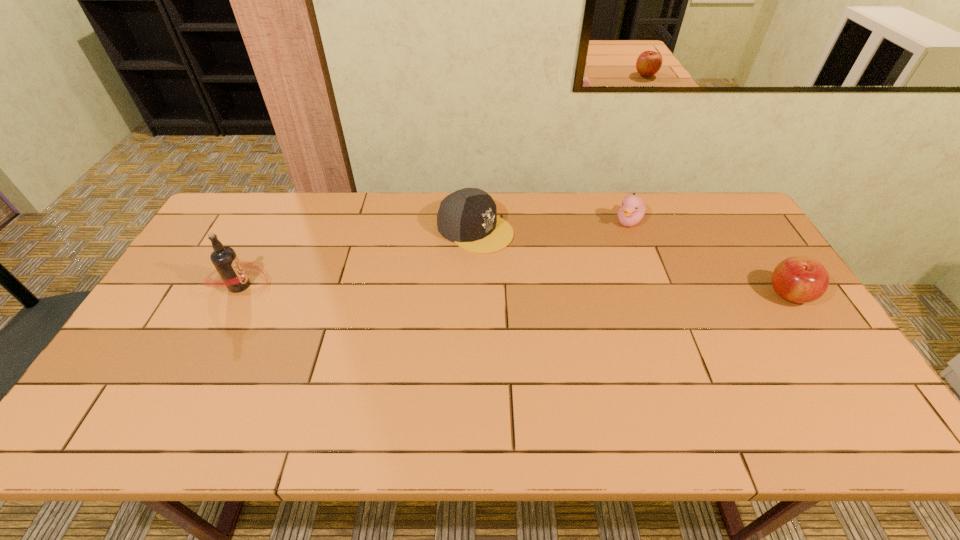
Identify the location of vacant space at the near edge of the desktop. (220, 390).

In the image, there is a desktop. Identify the location of vacant space at the left edge. (192, 281).

Where is `vacant space at the right edge of the desktop`? The image size is (960, 540). vacant space at the right edge of the desktop is located at coordinates (786, 306).

What are the coordinates of `vacant space at the far left corner of the desktop` in the screenshot? It's located at (268, 195).

Identify the location of vacant area at the near left corner of the desktop. The image size is (960, 540). (121, 377).

The image size is (960, 540). Find the location of `free space at the far right corner of the desktop`. free space at the far right corner of the desktop is located at coordinates (688, 199).

This screenshot has width=960, height=540. I want to click on vacant area that lies between the cap and the second object from right to left, so click(x=552, y=225).

Identify the location of free space between the tallest object and the duckling. (435, 253).

I want to click on free space between the tallest object and the cap, so click(x=358, y=258).

Image resolution: width=960 pixels, height=540 pixels. I want to click on vacant region between the duckling and the rightmost object, so click(x=709, y=258).